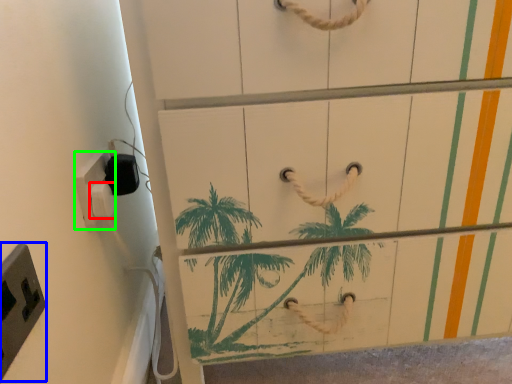
Question: Considering the real-world distances, which object is closest to light switch (highlighted by a red box)? light switch (highlighted by a blue box) or light switch (highlighted by a green box).

Choices:
 (A) light switch
 (B) light switch

Answer: (B)